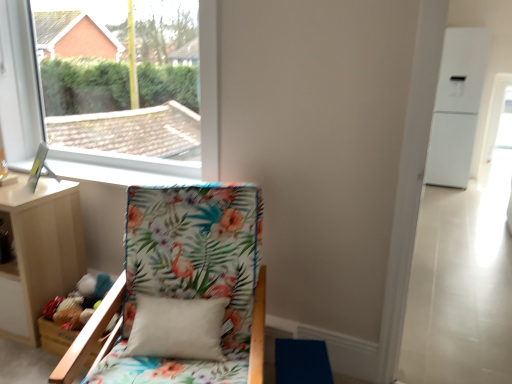
Find the location of a particular element. This screenshot has height=384, width=512. white plastic window at upper left is located at coordinates (17, 83).

You are a GUI agent. You are given a task and a screenshot of the screen. Output one action in this format:
    pyautogui.click(x=<x>, y=<y>)
    Task: Click on the floral fabric chair at lower left
    Image resolution: width=512 pixels, height=384 pixels.
    Given the screenshot: What is the action you would take?
    pyautogui.click(x=187, y=278)

This screenshot has width=512, height=384. Identify the location of white plastic window at upper left. tap(17, 83).

Is white plastic window at upper left facing away from light wood nightstand at lower left?

No, white plastic window at upper left's orientation is not away from light wood nightstand at lower left.

In the scene shown: Can you see white plastic window at upper left touching light wood nightstand at lower left?

There is a gap between white plastic window at upper left and light wood nightstand at lower left.

Can you confirm if white plastic window at upper left is smaller than light wood nightstand at lower left?

Actually, white plastic window at upper left might be larger than light wood nightstand at lower left.

Is white plastic window at upper left taller than light wood nightstand at lower left?

Yes, white plastic window at upper left is taller than light wood nightstand at lower left.

Which object is positioned more to the left, white plastic window at upper left or floral fabric chair at lower left?

From the viewer's perspective, white plastic window at upper left appears more on the left side.

Is white plastic window at upper left positioned beyond the bounds of floral fabric chair at lower left?

That's correct, white plastic window at upper left is outside of floral fabric chair at lower left.

Is white plastic window at upper left taller than floral fabric chair at lower left?

Indeed, white plastic window at upper left has a greater height compared to floral fabric chair at lower left.

Is white plastic window at upper left turned away from floral fabric chair at lower left?

white plastic window at upper left is not turned away from floral fabric chair at lower left.

Is floral fabric chair at lower left oriented towards light wood nightstand at lower left?

No, floral fabric chair at lower left does not turn towards light wood nightstand at lower left.

Is floral fabric chair at lower left behind light wood nightstand at lower left?

No, floral fabric chair at lower left is closer to the camera.

Between point (149, 228) and point (76, 213), which one is positioned behind?

The point (76, 213) is farther.

Does light wood nightstand at lower left have a larger size compared to floral fabric chair at lower left?

Incorrect, light wood nightstand at lower left is not larger than floral fabric chair at lower left.

Which is correct: light wood nightstand at lower left is inside floral fabric chair at lower left, or outside of it?

light wood nightstand at lower left is located beyond the bounds of floral fabric chair at lower left.

How many degrees apart are the facing directions of light wood nightstand at lower left and floral fabric chair at lower left?

The angle between the facing direction of light wood nightstand at lower left and the facing direction of floral fabric chair at lower left is 19.9 degrees.

Is light wood nightstand at lower left placed right next to floral fabric chair at lower left?

There is a gap between light wood nightstand at lower left and floral fabric chair at lower left.

Is white plastic window at upper left surrounded by floral fabric chair at lower left?

No, white plastic window at upper left is not inside floral fabric chair at lower left.

Does point (156, 251) appear closer or farther from the camera than point (108, 164)?

Point (156, 251) is positioned closer to the camera compared to point (108, 164).

Between floral fabric chair at lower left and white plastic window at upper left, which one has larger width?

floral fabric chair at lower left is wider.

Considering the sizes of floral fabric chair at lower left and white plastic window at upper left in the image, is floral fabric chair at lower left bigger or smaller than white plastic window at upper left?

In the image, floral fabric chair at lower left appears to be larger than white plastic window at upper left.

Find the location of a particular element. The width and height of the screenshot is (512, 384). window that is above the light wood nightstand at lower left (from the image's perspective) is located at coordinates (17, 83).

Which object is closer to the camera taking this photo, light wood nightstand at lower left or white plastic window at upper left?

white plastic window at upper left is closer to the camera.

Based on their positions, is light wood nightstand at lower left located to the left or right of white plastic window at upper left?

In the image, light wood nightstand at lower left appears on the left side of white plastic window at upper left.

Find the location of a particular element. Image resolution: width=512 pixels, height=384 pixels. nightstand on the left of white plastic window at upper left is located at coordinates (39, 252).

This screenshot has width=512, height=384. Identify the location of chair in front of the white plastic window at upper left. (187, 278).

Looking at the image, which one is located closer to floral fabric chair at lower left, white plastic window at upper left or light wood nightstand at lower left?

light wood nightstand at lower left is closer to floral fabric chair at lower left.

When comparing their distances from floral fabric chair at lower left, does light wood nightstand at lower left or white plastic window at upper left seem closer?

light wood nightstand at lower left.

When comparing their distances from light wood nightstand at lower left, does white plastic window at upper left or floral fabric chair at lower left seem further?

white plastic window at upper left is positioned further to the anchor light wood nightstand at lower left.

Looking at the image, which one is located closer to white plastic window at upper left, floral fabric chair at lower left or light wood nightstand at lower left?

Among the two, light wood nightstand at lower left is located nearer to white plastic window at upper left.

From the image, which object appears to be nearer to light wood nightstand at lower left, floral fabric chair at lower left or white plastic window at upper left?

floral fabric chair at lower left lies closer to light wood nightstand at lower left than the other object.

Looking at the image, which one is located closer to white plastic window at upper left, light wood nightstand at lower left or floral fabric chair at lower left?

light wood nightstand at lower left.

Locate an element on the screen. Image resolution: width=512 pixels, height=384 pixels. nightstand that lies between white plastic window at upper left and floral fabric chair at lower left from top to bottom is located at coordinates (39, 252).